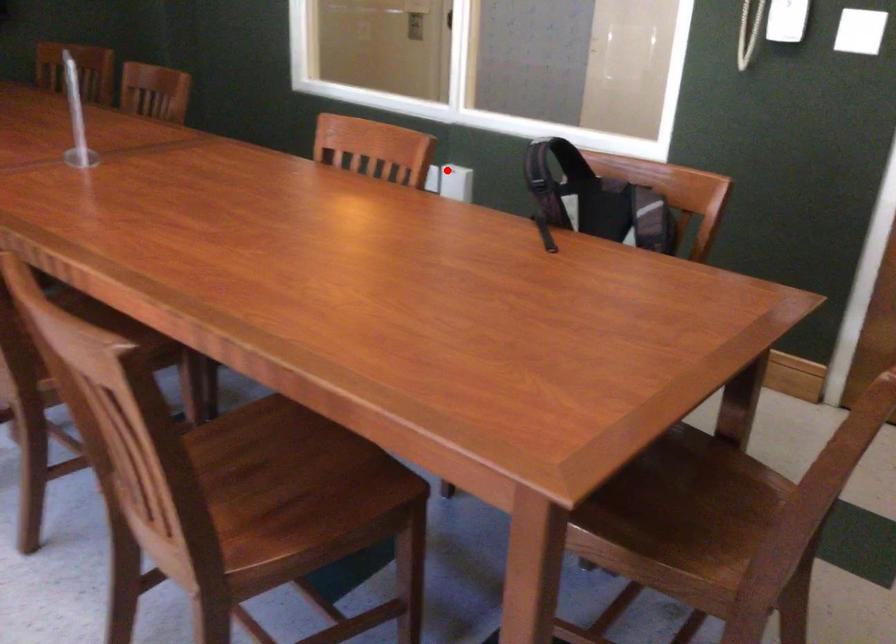
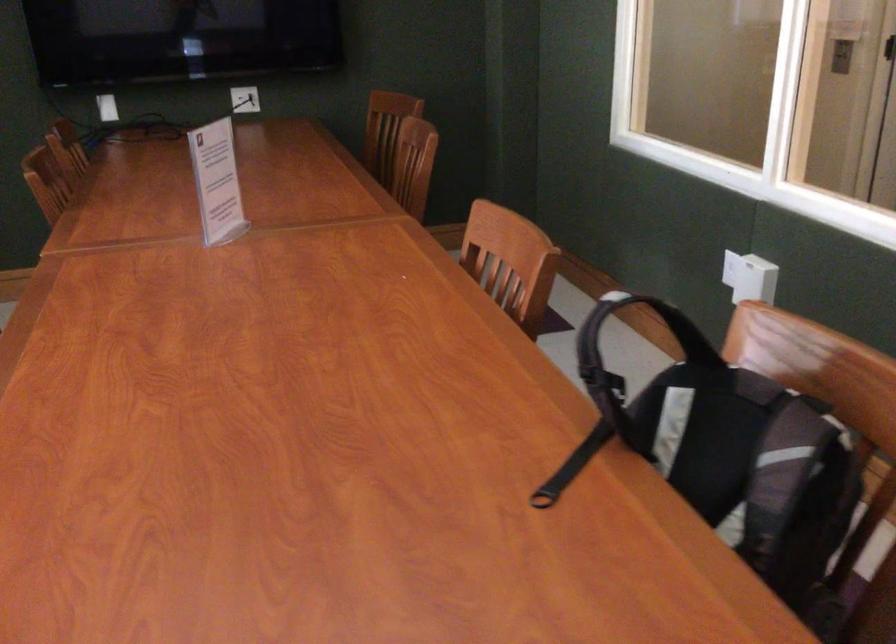
In the second image, find the point that corresponds to the highlighted location in the first image.

(742, 269)